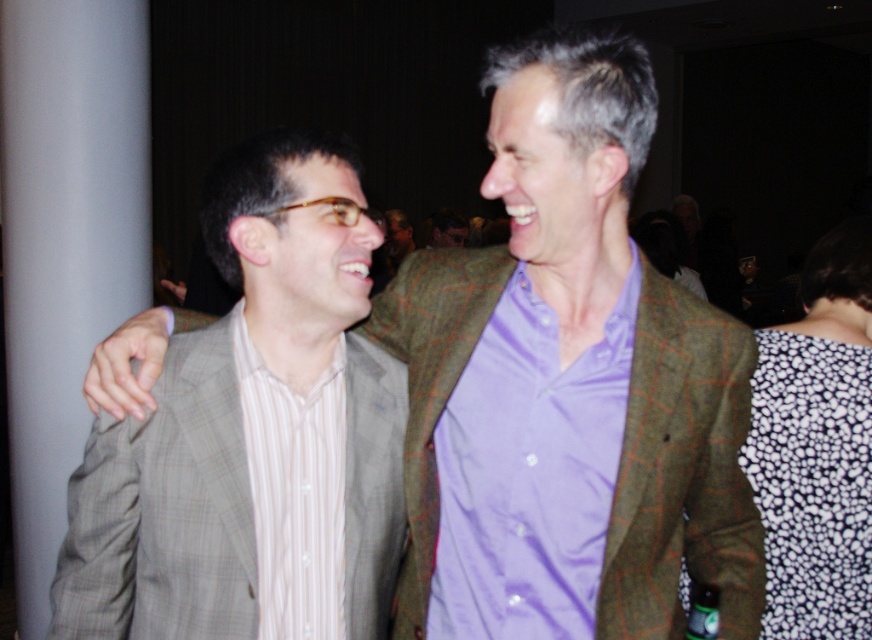
You are standing in a dimly lit room at a social event. You see a point marked at coordinates (445, 618). If you want to take a photo of this point with your camera, will the point be in focus if your camera has a depth of field that can focus on objects within 1.1 meters from the camera?

The point at coordinates (445, 618) is 1.17 meters from the camera. Since the depth of field can only focus within 1.1 meters, the point is slightly out of range and will not be in focus.

You are organizing a charity event and need to arrange shirts on a display rack. The lavender satin shirt at center and the white striped shirt at left must be placed side by side. Which shirt should you place on the left side to ensure the display looks balanced?

The lavender satin shirt at center is bigger than the white striped shirt at left, so placing the larger lavender satin shirt at center on the left side would create a balanced display.

Based on the photo, you are a photographer at a social event and need to adjust the lighting to ensure both the light gray checkered suit at center and the white striped shirt at left are well illuminated. Based on their positions, which one might require more direct lighting to avoid appearing too dark?

The white striped shirt at left might require more direct lighting because it is positioned lower than the light gray checkered suit at center, which could mean it is in a darker area of the image.